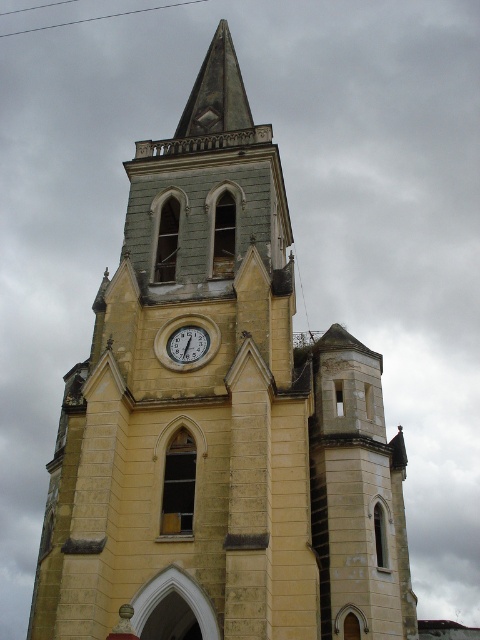
Does white glossy clock at center appear under matte white clock at center?

No.

Can you confirm if white glossy clock at center is bigger than matte white clock at center?

Yes.

I want to click on white glossy clock at center, so click(187, 340).